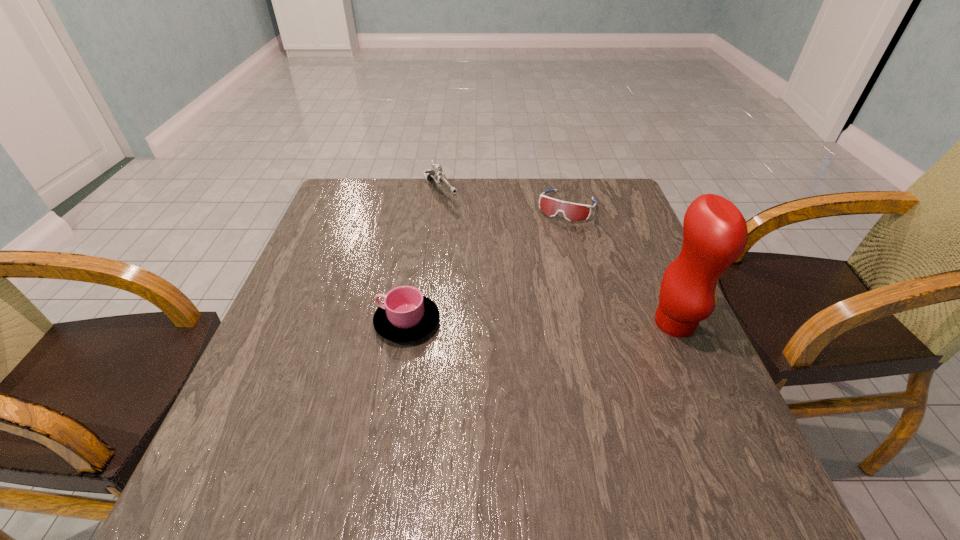
Where is `vacant area that lies between the condiment and the goggles`? The width and height of the screenshot is (960, 540). vacant area that lies between the condiment and the goggles is located at coordinates [621, 265].

The height and width of the screenshot is (540, 960). I want to click on vacant area that lies between the cup and the rightmost object, so click(x=540, y=322).

The height and width of the screenshot is (540, 960). What are the coordinates of `empty location between the cup and the condiment` in the screenshot? It's located at (540, 322).

Where is `blank region between the rightmost object and the goggles`? The height and width of the screenshot is (540, 960). blank region between the rightmost object and the goggles is located at coordinates (621, 265).

The height and width of the screenshot is (540, 960). Identify the location of vacant region between the goggles and the condiment. (621, 265).

You are a GUI agent. You are given a task and a screenshot of the screen. Output one action in this format:
    pyautogui.click(x=<x>, y=<y>)
    Task: Click on the empty location between the third object from left to right and the cup
    The image size is (960, 540).
    Given the screenshot: What is the action you would take?
    pyautogui.click(x=487, y=265)

Point out which object is positioned as the nearest to the condiment. Please provide its 2D coordinates. Your answer should be formatted as a tuple, i.e. [(x, y)], where the tuple contains the x and y coordinates of a point satisfying the conditions above.

[(572, 212)]

Identify which object is located as the nearest to the gun. Please provide its 2D coordinates. Your answer should be formatted as a tuple, i.e. [(x, y)], where the tuple contains the x and y coordinates of a point satisfying the conditions above.

[(572, 212)]

Where is `free space that satisfies the following two spatial constraints: 1. on the front side of the goggles; 2. on the left side of the gun`? Image resolution: width=960 pixels, height=540 pixels. free space that satisfies the following two spatial constraints: 1. on the front side of the goggles; 2. on the left side of the gun is located at coordinates coord(439,207).

The height and width of the screenshot is (540, 960). Find the location of `vacant space that satisfies the following two spatial constraints: 1. on the front side of the condiment; 2. on the label side of the third shortest object`. vacant space that satisfies the following two spatial constraints: 1. on the front side of the condiment; 2. on the label side of the third shortest object is located at coordinates (423, 323).